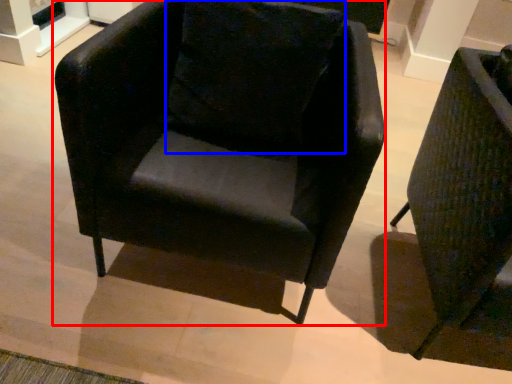
Question: Which of the following is the farthest to the observer, chair (highlighted by a red box) or pillow (highlighted by a blue box)?

Choices:
 (A) chair
 (B) pillow

Answer: (B)